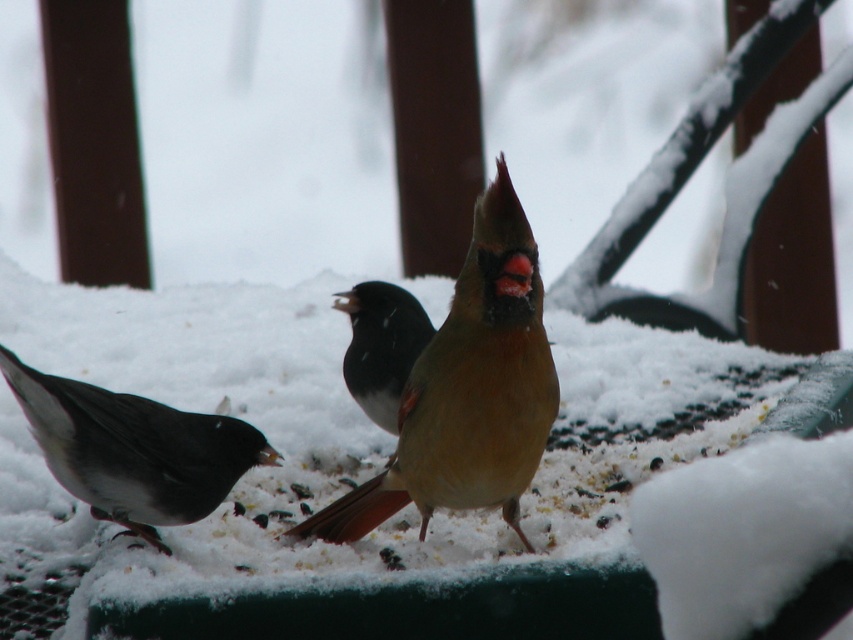
Question: Which point appears closest to the camera in this image?

Choices:
 (A) (373, 296)
 (B) (106, 417)
 (C) (437, 387)

Answer: (C)

Question: Can you confirm if matte yellow bird at center is positioned above dark gray matte sparrow at lower left?

Choices:
 (A) no
 (B) yes

Answer: (B)

Question: Does dark gray matte sparrow at lower left lie behind shiny black bird at center?

Choices:
 (A) no
 (B) yes

Answer: (A)

Question: Estimate the real-world distances between objects in this image. Which object is farther from the shiny black bird at center?

Choices:
 (A) dark gray matte sparrow at lower left
 (B) matte yellow bird at center

Answer: (B)

Question: Is dark gray matte sparrow at lower left above shiny black bird at center?

Choices:
 (A) no
 (B) yes

Answer: (A)

Question: Which of the following is the farthest from the observer?

Choices:
 (A) shiny black bird at center
 (B) dark gray matte sparrow at lower left
 (C) matte yellow bird at center

Answer: (A)